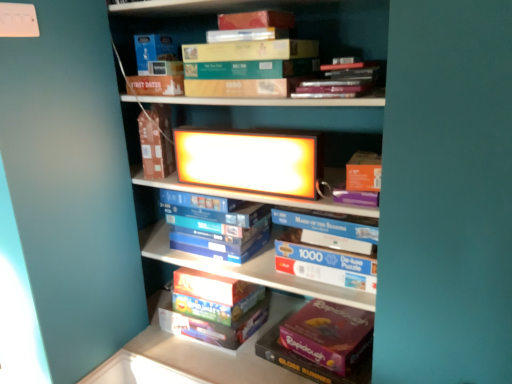
Question: From the image's perspective, is matte cardboard book at upper center under matte green cardboard box at upper center, which appears as the 4th book when ordered from the bottom?

Choices:
 (A) no
 (B) yes

Answer: (B)

Question: Is matte cardboard book at upper center far away from matte green cardboard box at upper center, which appears as the 4th book when ordered from the bottom?

Choices:
 (A) yes
 (B) no

Answer: (B)

Question: Can matte green cardboard box at upper center, which appears as the 4th book when ordered from the bottom, be found inside matte cardboard book at upper center?

Choices:
 (A) yes
 (B) no

Answer: (B)

Question: Is matte cardboard book at upper center aimed at matte green cardboard box at upper center, which is the first book from top to bottom?

Choices:
 (A) no
 (B) yes

Answer: (A)

Question: Does matte cardboard book at upper center have a larger size compared to matte green cardboard box at upper center, which is the first book from top to bottom?

Choices:
 (A) no
 (B) yes

Answer: (A)

Question: From a real-world perspective, relative to blue cardboard box at center, the second book in the bottom-to-top sequence, is matte green cardboard box at upper center, which is the first book from top to bottom, vertically above or below?

Choices:
 (A) above
 (B) below

Answer: (A)

Question: Considering the relative positions of matte green cardboard box at upper center, which appears as the 4th book when ordered from the bottom, and blue cardboard box at center, which is counted as the 3th book, starting from the top, in the image provided, is matte green cardboard box at upper center, which appears as the 4th book when ordered from the bottom, to the left or to the right of blue cardboard box at center, which is counted as the 3th book, starting from the top,?

Choices:
 (A) left
 (B) right

Answer: (B)

Question: Is point (378, 79) positioned closer to the camera than point (183, 210)?

Choices:
 (A) farther
 (B) closer

Answer: (B)

Question: From the image's perspective, relative to blue cardboard box at center, which is counted as the 3th book, starting from the top, is matte green cardboard box at upper center, which is the first book from top to bottom, above or below?

Choices:
 (A) below
 (B) above

Answer: (B)

Question: From a real-world perspective, is matte cardboard box at center, which ranks as the 1th book in bottom-to-top order, above or below blue cardboard box at center, which is counted as the 3th book, starting from the top?

Choices:
 (A) below
 (B) above

Answer: (A)

Question: Does point (193, 281) appear closer or farther from the camera than point (209, 218)?

Choices:
 (A) closer
 (B) farther

Answer: (B)

Question: Based on their sizes in the image, would you say matte cardboard box at center, which ranks as the fourth book in top-to-bottom order, is bigger or smaller than blue cardboard box at center, the second book in the bottom-to-top sequence?

Choices:
 (A) small
 (B) big

Answer: (B)

Question: Is matte cardboard box at center, which ranks as the fourth book in top-to-bottom order, in front of or behind blue cardboard box at center, the second book in the bottom-to-top sequence, in the image?

Choices:
 (A) behind
 (B) front

Answer: (A)

Question: From a real-world perspective, relative to blue cardboard box at center, which is counted as the 3th book, starting from the top, is bright yellow plastic lightbox at center vertically above or below?

Choices:
 (A) above
 (B) below

Answer: (A)

Question: From the image's perspective, relative to blue cardboard box at center, the second book in the bottom-to-top sequence, is bright yellow plastic lightbox at center above or below?

Choices:
 (A) above
 (B) below

Answer: (A)